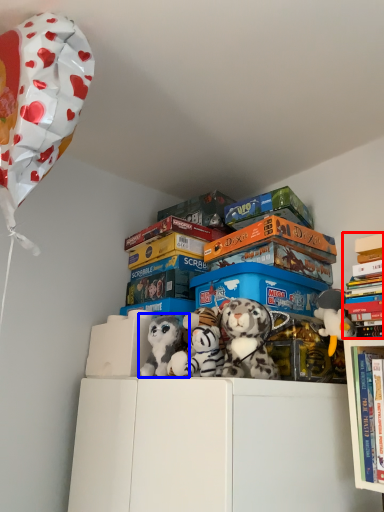
Question: Which of the following is the farthest to the observer, book (highlighted by a red box) or toy (highlighted by a blue box)?

Choices:
 (A) book
 (B) toy

Answer: (B)